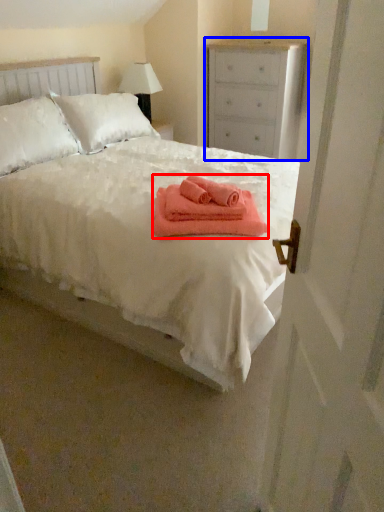
Question: Among these objects, which one is nearest to the camera, bath towel (highlighted by a red box) or chest of drawers (highlighted by a blue box)?

Choices:
 (A) bath towel
 (B) chest of drawers

Answer: (A)